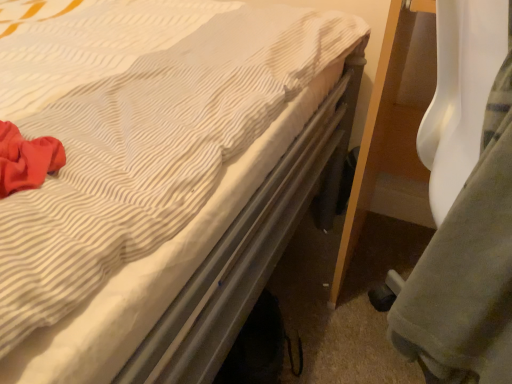
Measure the distance between gray cotton towel at right and camera.

The distance of gray cotton towel at right from camera is 12.47 inches.

Where is `gray cotton towel at right`? gray cotton towel at right is located at coordinates (467, 268).

The width and height of the screenshot is (512, 384). Describe the element at coordinates (467, 268) in the screenshot. I see `gray cotton towel at right` at that location.

You are a GUI agent. You are given a task and a screenshot of the screen. Output one action in this format:
    pyautogui.click(x=<x>, y=<y>)
    Task: Click on the gray cotton towel at right
    The image size is (512, 384).
    Given the screenshot: What is the action you would take?
    pyautogui.click(x=467, y=268)